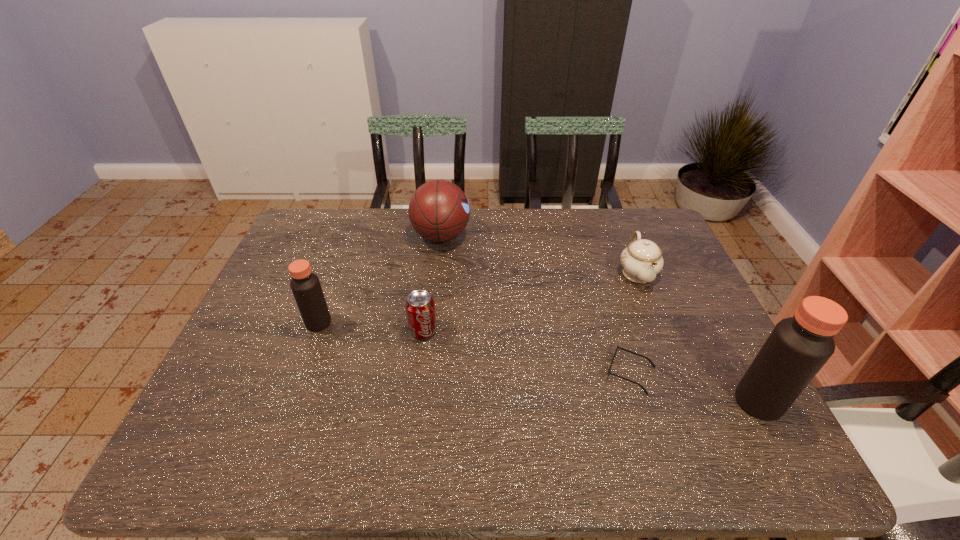
The width and height of the screenshot is (960, 540). I want to click on spot to insert another vinegar for uniform distribution, so click(520, 359).